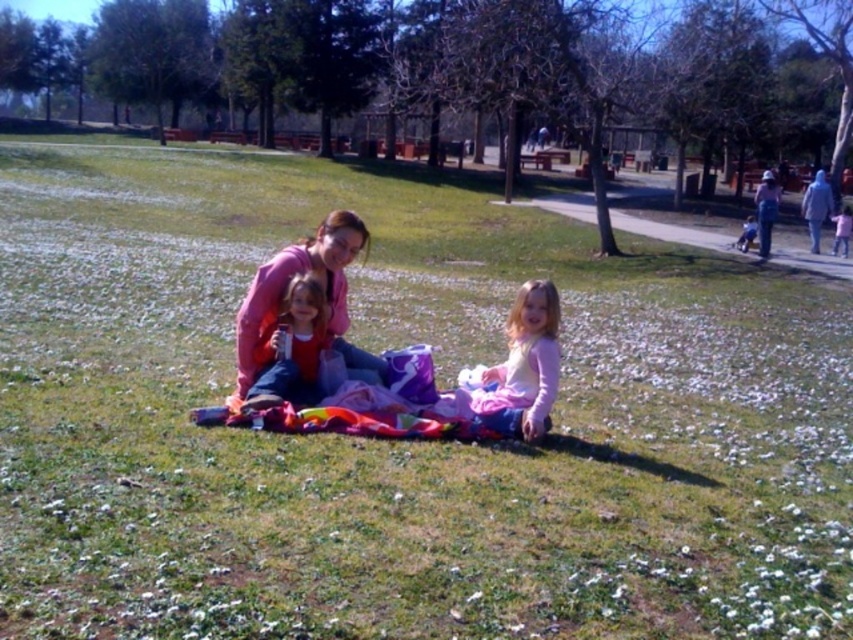
You are a photographer setting up a shot of the scene. You need to ensure the matte pink sweater at center and the pink fabric at lower right are both in focus. Which object should you adjust your camera focus to first to capture both?

The matte pink sweater at center is located below the pink fabric at lower right. To capture both in focus, adjust the camera focus starting with the pink fabric at lower right since it is farther away, then ensure the matte pink sweater at center is within the depth of field.

You are planning to place a small picnic basket on the fabric that is wider. Which fabric should you choose between the light blue fabric at right and the pink fabric at lower right?

The light blue fabric at right is wider than the pink fabric at lower right, so you should choose the light blue fabric at right.